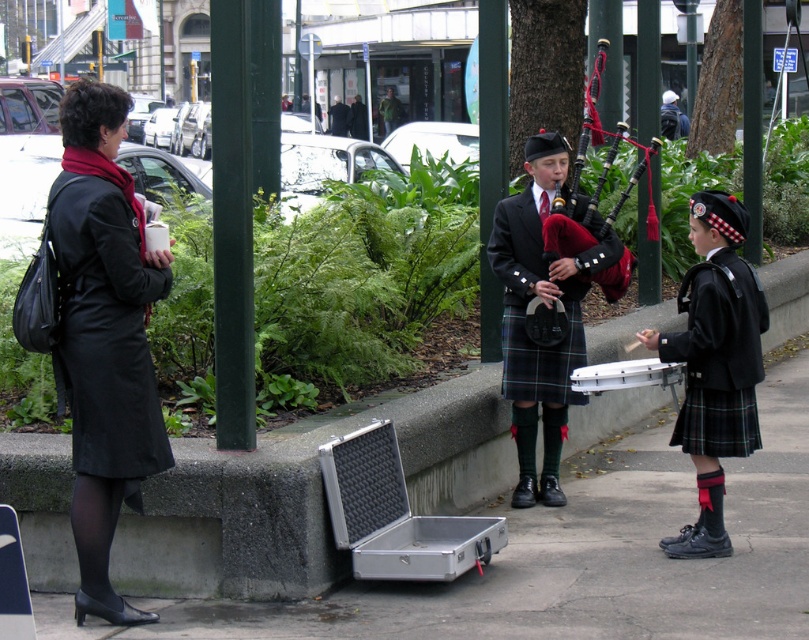
You are a photographer trying to capture both the red velvet bagpipe at center and the green fabric jacket at center in a single frame. Based on their sizes, which object should you focus on to ensure both fit comfortably in the photo?

The red velvet bagpipe at center is wider than the green fabric jacket at center, so focusing on the wider red velvet bagpipe at center will help ensure both objects fit comfortably in the photo.

You are a photographer trying to capture both the red velvet bagpipe at center and the green fabric jacket at center in a single frame. Based on their heights, which object should you focus on first to ensure both are fully visible in the photo?

The red velvet bagpipe at center is not as tall as the green fabric jacket at center, so you should focus on the taller green fabric jacket at center first to ensure both are fully visible in the photo.

You are standing in the street scene and want to walk towards the two points marked in the image. Which point, point (710, 618) or point (329, 109), will you reach first?

Point (710, 618) is closer to the viewer than point (329, 109), so you will reach point (710, 618) first.